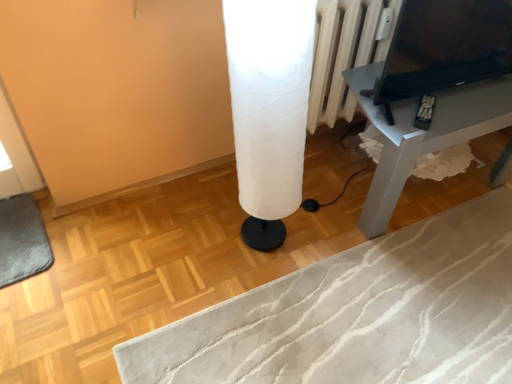
Question: Is white fabric lampshade at center facing towards matte gray table at right?

Choices:
 (A) no
 (B) yes

Answer: (A)

Question: Considering the relative positions of white fabric lampshade at center and matte gray table at right in the image provided, is white fabric lampshade at center to the left of matte gray table at right from the viewer's perspective?

Choices:
 (A) no
 (B) yes

Answer: (B)

Question: Is white fabric lampshade at center beside matte gray table at right?

Choices:
 (A) yes
 (B) no

Answer: (B)

Question: Is white fabric lampshade at center completely or partially outside of matte gray table at right?

Choices:
 (A) no
 (B) yes

Answer: (B)

Question: Does white fabric lampshade at center have a lesser height compared to matte gray table at right?

Choices:
 (A) no
 (B) yes

Answer: (A)

Question: Is the depth of white fabric lampshade at center greater than that of matte gray table at right?

Choices:
 (A) yes
 (B) no

Answer: (B)

Question: Is matte gray table at right positioned behind black glossy tv at upper right?

Choices:
 (A) no
 (B) yes

Answer: (B)

Question: Is matte gray table at right facing away from black glossy tv at upper right?

Choices:
 (A) yes
 (B) no

Answer: (B)

Question: From the image's perspective, is matte gray table at right above black glossy tv at upper right?

Choices:
 (A) no
 (B) yes

Answer: (A)

Question: Is matte gray table at right thinner than black glossy tv at upper right?

Choices:
 (A) no
 (B) yes

Answer: (A)

Question: From a real-world perspective, is matte gray table at right physically below black glossy tv at upper right?

Choices:
 (A) no
 (B) yes

Answer: (B)

Question: From a real-world perspective, is matte gray table at right physically above black glossy tv at upper right?

Choices:
 (A) no
 (B) yes

Answer: (A)

Question: From the image's perspective, is white fabric lampshade at center over black glossy tv at upper right?

Choices:
 (A) no
 (B) yes

Answer: (A)